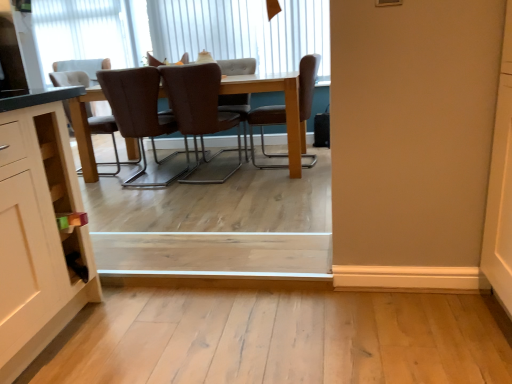
Question: Does white textured window at upper left, which is counted as the first window, starting from the left, touch brown leather chair at center, which appears as the 3th chair when viewed from the left?

Choices:
 (A) yes
 (B) no

Answer: (B)

Question: Does white textured window at upper left, which is counted as the 2th window, starting from the bottom, have a smaller size compared to brown leather chair at center, which appears as the 3th chair when viewed from the left?

Choices:
 (A) no
 (B) yes

Answer: (B)

Question: Could brown leather chair at center, which appears as the 3th chair when viewed from the left, be considered to be inside white textured window at upper left, which is counted as the 2th window, starting from the bottom?

Choices:
 (A) yes
 (B) no

Answer: (B)

Question: Is white textured window at upper left, which is the 1th window in top-to-bottom order, further to the viewer compared to brown leather chair at center, which appears as the 3th chair when viewed from the left?

Choices:
 (A) no
 (B) yes

Answer: (B)

Question: From the image's perspective, is white textured window at upper left, which is counted as the 2th window, starting from the bottom, beneath brown leather chair at center, which appears as the 3th chair when viewed from the left?

Choices:
 (A) yes
 (B) no

Answer: (B)

Question: Looking at their shapes, would you say brown fabric chair at center, the second chair positioned from the left, is wider or thinner than white textured window at upper left, which is counted as the first window, starting from the left?

Choices:
 (A) wide
 (B) thin

Answer: (A)

Question: From a real-world perspective, relative to white textured window at upper left, acting as the first window starting from the back, is brown fabric chair at center, the second chair positioned from the left, vertically above or below?

Choices:
 (A) below
 (B) above

Answer: (A)

Question: Is point (89, 119) closer or farther from the camera than point (42, 69)?

Choices:
 (A) farther
 (B) closer

Answer: (B)

Question: Is brown fabric chair at center, positioned as the sixth chair in right-to-left order, to the left or to the right of white textured window at upper left, which is counted as the 2th window, starting from the bottom, in the image?

Choices:
 (A) right
 (B) left

Answer: (A)

Question: In terms of height, does brown leather chair at center, the 1th chair viewed from the right, look taller or shorter compared to white textured window at upper left, which is the 1th window in top-to-bottom order?

Choices:
 (A) short
 (B) tall

Answer: (A)

Question: From the image's perspective, is brown leather chair at center, the 1th chair viewed from the right, above or below white textured window at upper left, marked as the second window in a front-to-back arrangement?

Choices:
 (A) below
 (B) above

Answer: (A)

Question: Considering their positions, is brown leather chair at center, the 1th chair viewed from the right, located in front of or behind white textured window at upper left, marked as the second window in a front-to-back arrangement?

Choices:
 (A) behind
 (B) front

Answer: (B)

Question: From a real-world perspective, relative to white textured window at upper left, which is counted as the first window, starting from the left, is brown leather chair at center, placed as the 7th chair when sorted from left to right, vertically above or below?

Choices:
 (A) below
 (B) above

Answer: (A)

Question: From a real-world perspective, is brown leather chair at center, the 5th chair when ordered from right to left, physically located above or below brown leather chair at upper center, which is counted as the 4th chair, starting from the right?

Choices:
 (A) below
 (B) above

Answer: (A)

Question: From the image's perspective, is brown leather chair at center, which appears as the 3th chair when viewed from the left, above or below brown leather chair at upper center, which is counted as the 4th chair, starting from the right?

Choices:
 (A) below
 (B) above

Answer: (A)